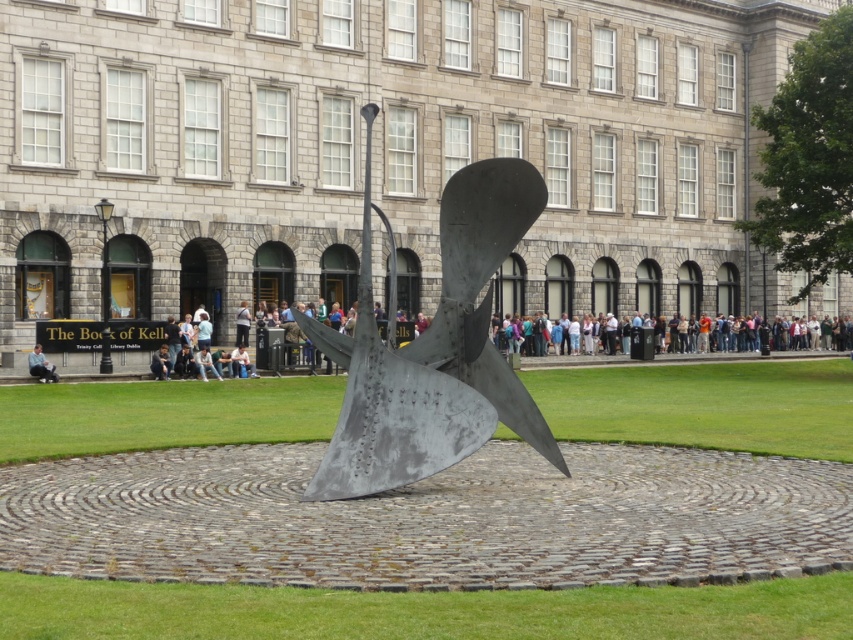
You are standing in front of the historic stone building and see the metallic sculpture at center and the light blue jeans at lower left. Which object is closer to you?

The light blue jeans at lower left are closer to you because the metallic sculpture at center is located above them, meaning it is further away.

You are standing at the base of the sculpture and want to walk towards the historic stone building. There is green grass at center and light blue denim jeans at lower center in your path. Which object will you encounter first?

The light blue denim jeans at lower center will be encountered first since they are closer to you than the green grass at center, which is farther away.